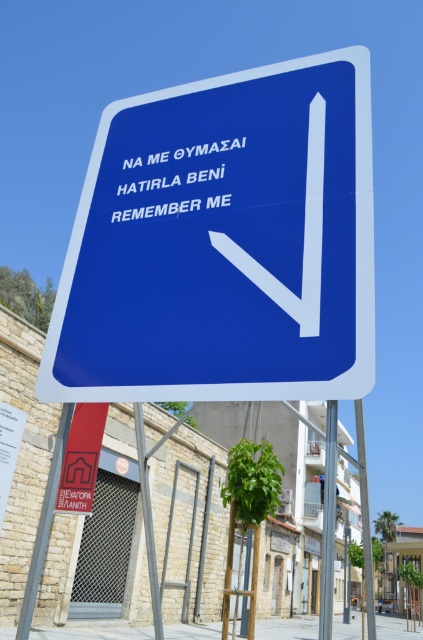
Question: Which object is closer to the camera taking this photo?

Choices:
 (A) gray concrete pavement at lower center
 (B) blue plastic sign at center

Answer: (B)

Question: Based on their relative distances, which object is farther from the blue plastic sign at center?

Choices:
 (A) gray concrete pavement at lower center
 (B) metallic pole at lower left
 (C) white plastic arrow at center
 (D) white plastic text at center

Answer: (A)

Question: Can you confirm if white plastic arrow at center is bigger than matte red house at lower left?

Choices:
 (A) yes
 (B) no

Answer: (B)

Question: In this image, where is matte red house at lower left located relative to white plastic text at center?

Choices:
 (A) right
 (B) left

Answer: (B)

Question: Is the position of white plastic arrow at center more distant than that of matte red house at lower left?

Choices:
 (A) yes
 (B) no

Answer: (B)

Question: Which point is farther from the camera taking this photo?

Choices:
 (A) (66, 404)
 (B) (82, 448)
 (C) (323, 516)
 (D) (362, 531)

Answer: (D)